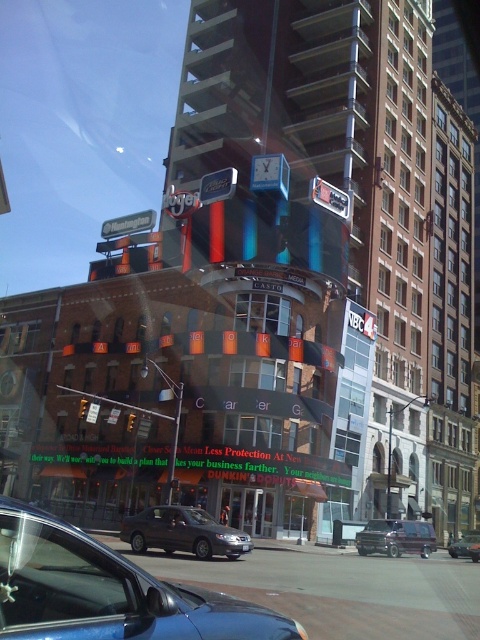
You are a delivery driver navigating through the city. You need to deliver a package to a location marked by point [194,541] and then to point [479,552]. Based on the image, which delivery point should you visit first?

You should visit point [194,541] first because it is in front of point [479,552], meaning it is closer to your current position.

You are a delivery driver who needs to park your vehicle in a tight space. You see the dark gray metallic sedan at center and the metallic purple van at center. Which vehicle would require more space to park?

The metallic purple van at center would require more space to park because it occupies more space than the dark gray metallic sedan at center.